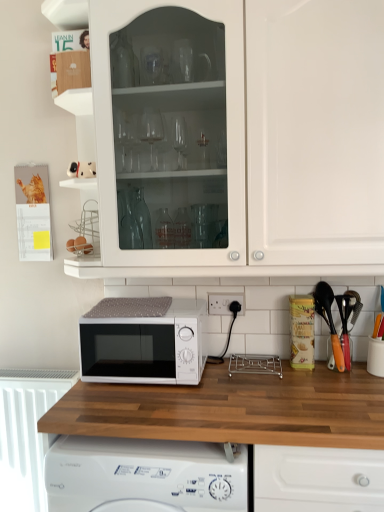
Question: Is white matte microwave at center further to camera compared to white plastic radiator at lower left?

Choices:
 (A) no
 (B) yes

Answer: (A)

Question: Is white matte microwave at center wider than white plastic radiator at lower left?

Choices:
 (A) yes
 (B) no

Answer: (A)

Question: Is white matte microwave at center turned away from white plastic radiator at lower left?

Choices:
 (A) yes
 (B) no

Answer: (B)

Question: Does white matte microwave at center have a lesser height compared to white plastic radiator at lower left?

Choices:
 (A) yes
 (B) no

Answer: (A)

Question: Does white matte microwave at center appear on the left side of white plastic radiator at lower left?

Choices:
 (A) yes
 (B) no

Answer: (B)

Question: Is white plastic electric outlet at lower center wider or thinner than wooden at center?

Choices:
 (A) thin
 (B) wide

Answer: (A)

Question: Is white plastic electric outlet at lower center bigger or smaller than wooden at center?

Choices:
 (A) small
 (B) big

Answer: (A)

Question: Considering the positions of point (211, 310) and point (130, 412), is point (211, 310) closer or farther from the camera than point (130, 412)?

Choices:
 (A) closer
 (B) farther

Answer: (B)

Question: Is white plastic electric outlet at lower center in front of or behind wooden at center in the image?

Choices:
 (A) behind
 (B) front

Answer: (A)

Question: Looking at their shapes, would you say white glossy cabinet at upper center is wider or thinner than wooden at center?

Choices:
 (A) thin
 (B) wide

Answer: (A)

Question: From the image's perspective, is white glossy cabinet at upper center above or below wooden at center?

Choices:
 (A) above
 (B) below

Answer: (A)

Question: Based on their sizes in the image, would you say white glossy cabinet at upper center is bigger or smaller than wooden at center?

Choices:
 (A) small
 (B) big

Answer: (B)

Question: Visually, is white glossy cabinet at upper center positioned to the left or to the right of wooden at center?

Choices:
 (A) left
 (B) right

Answer: (B)

Question: Is white plastic electric outlet at lower center inside or outside of white plastic radiator at lower left?

Choices:
 (A) outside
 (B) inside

Answer: (A)

Question: In terms of size, does white plastic electric outlet at lower center appear bigger or smaller than white plastic radiator at lower left?

Choices:
 (A) big
 (B) small

Answer: (B)